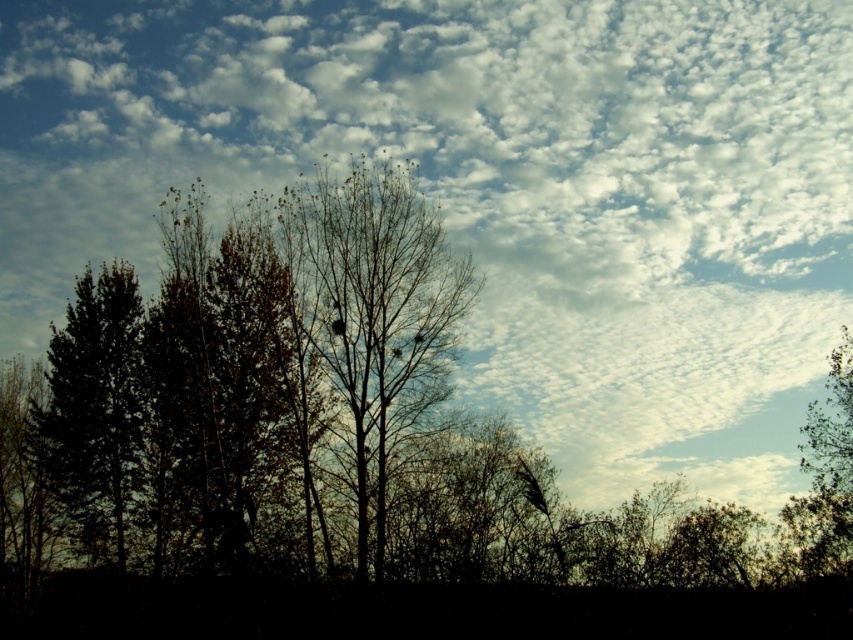
Question: Is bare branches at center to the right of dark green leafy tree at left from the viewer's perspective?

Choices:
 (A) no
 (B) yes

Answer: (B)

Question: Estimate the real-world distances between objects in this image. Which object is closer to the dark green leafy tree at left?

Choices:
 (A) green leafy tree at right
 (B) bare branches at center

Answer: (B)

Question: Which of the following is the farthest from the observer?

Choices:
 (A) (67, 481)
 (B) (846, 342)

Answer: (A)

Question: Is bare branches at center closer to the viewer compared to green leafy tree at right?

Choices:
 (A) yes
 (B) no

Answer: (A)

Question: Estimate the real-world distances between objects in this image. Which object is farther from the green leafy tree at right?

Choices:
 (A) dark green leafy tree at left
 (B) bare branches at center

Answer: (A)

Question: Can you confirm if bare branches at center is bigger than green leafy tree at right?

Choices:
 (A) no
 (B) yes

Answer: (B)